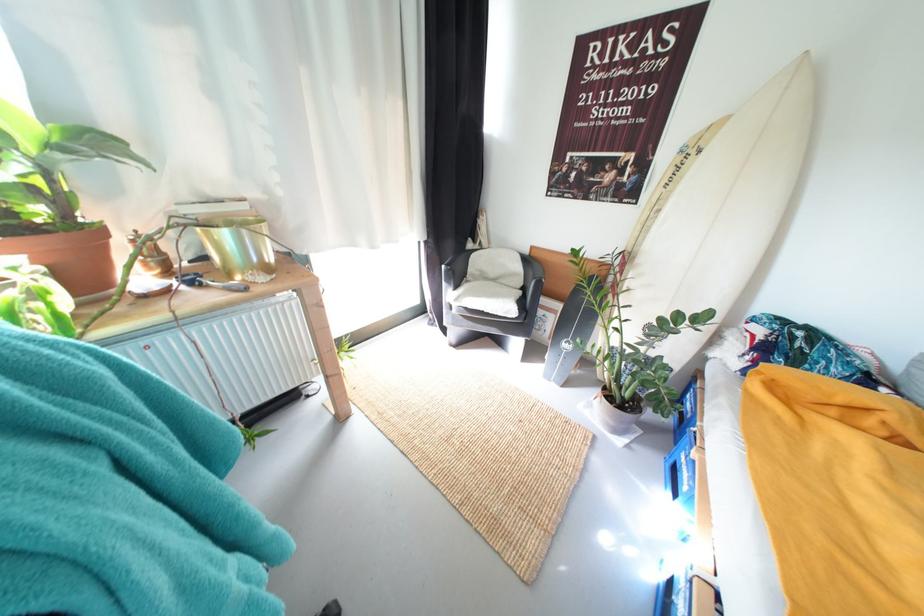
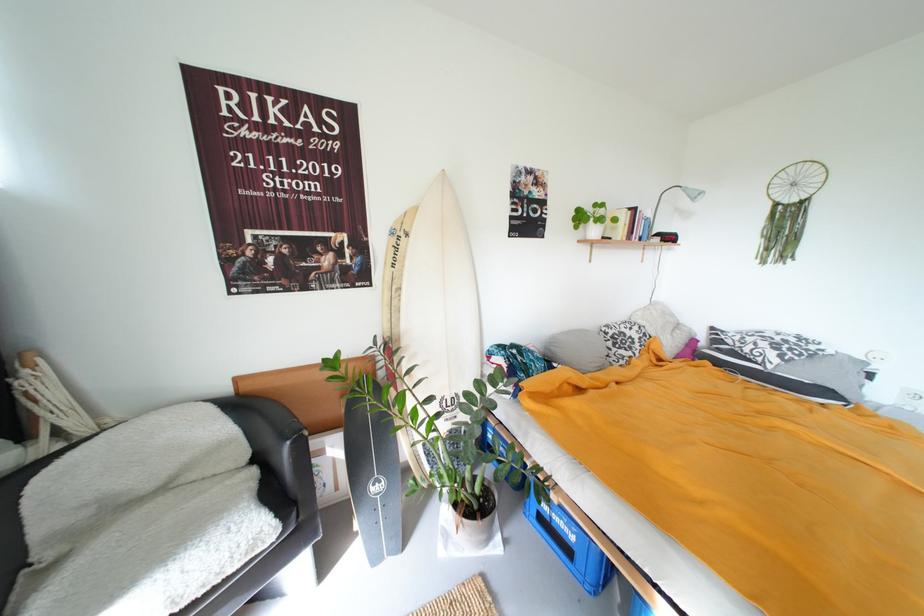
Question: The images are taken continuously from a first-person perspective. In which direction is your viewpoint rotating?

Choices:
 (A) Left
 (B) Right
 (C) Up
 (D) Down

Answer: (B)